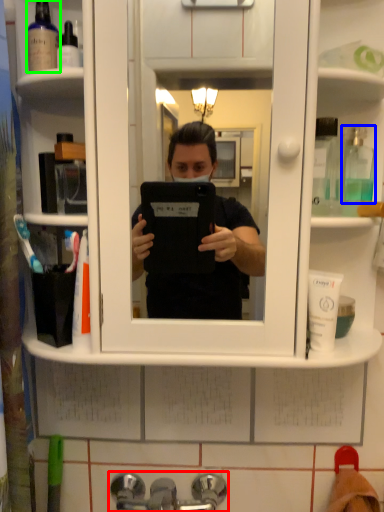
Question: Which object is positioned farthest from tap (highlighted by a red box)? Select from mouthwash (highlighted by a blue box) and mouthwash (highlighted by a green box).

Choices:
 (A) mouthwash
 (B) mouthwash

Answer: (B)